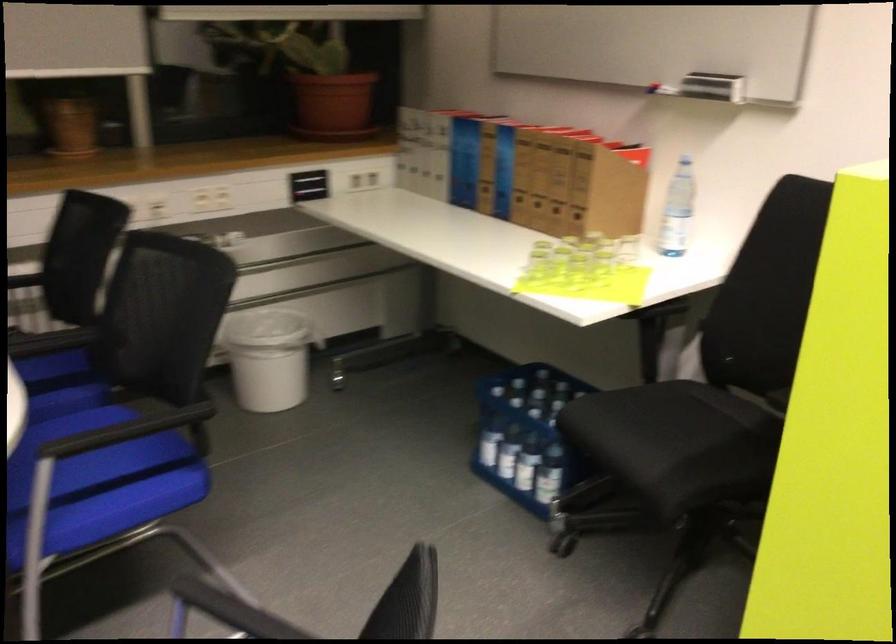
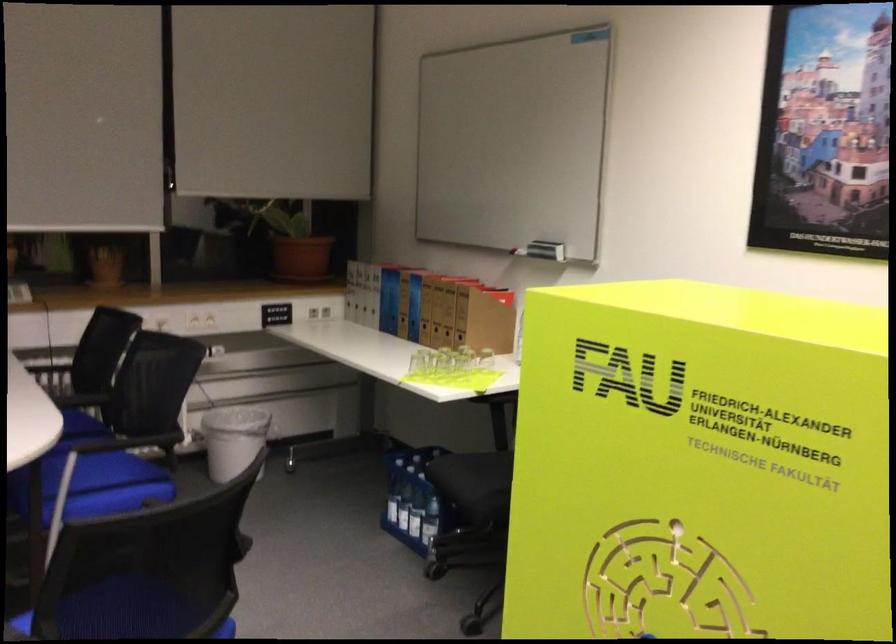
The point at (323,88) is marked in the first image. Where is the corresponding point in the second image?

(294, 243)